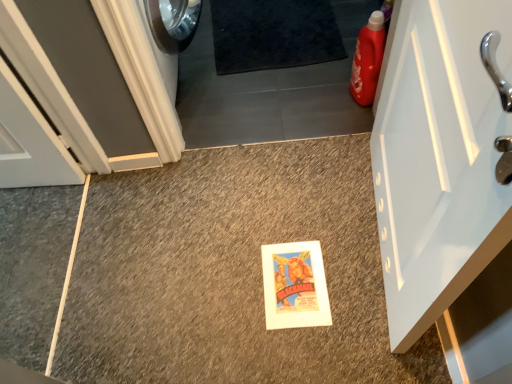
Question: Is point (377, 29) closer or farther from the camera than point (421, 59)?

Choices:
 (A) closer
 (B) farther

Answer: (B)

Question: Which is correct: matte plastic detergent at right is inside white glossy door at right, which is counted as the 2th door, starting from the left, or outside of it?

Choices:
 (A) inside
 (B) outside

Answer: (B)

Question: Which of these objects is positioned farthest from the matte plastic detergent at right?

Choices:
 (A) white glossy door at right, positioned as the 1th door in right-to-left order
 (B) black shaggy carpet at upper center
 (C) white painted wood door at left, which is counted as the second door, starting from the right

Answer: (C)

Question: Which is nearer to the white glossy door at right, positioned as the 1th door in right-to-left order?

Choices:
 (A) matte plastic detergent at right
 (B) black shaggy carpet at upper center
 (C) white painted wood door at left, the first door positioned from the left

Answer: (A)